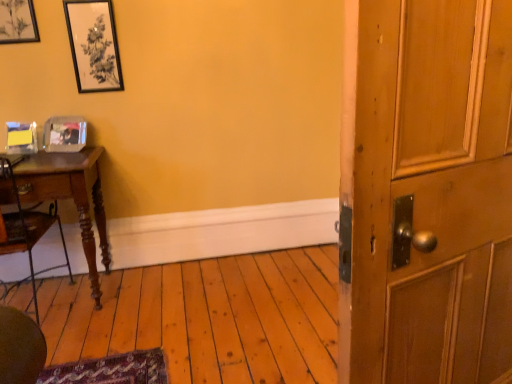
Question: Is matte black picture frame at upper left, the 3th picture frame ordered from the bottom, in contact with clear plastic picture frame at left, the 1th picture frame from the bottom?

Choices:
 (A) no
 (B) yes

Answer: (A)

Question: Does matte black picture frame at upper left, the 3th picture frame ordered from the bottom, have a smaller size compared to clear plastic picture frame at left, the 1th picture frame from the bottom?

Choices:
 (A) no
 (B) yes

Answer: (B)

Question: Is matte black picture frame at upper left, the 3th picture frame ordered from the bottom, at the left side of clear plastic picture frame at left, which is the third picture frame in top-to-bottom order?

Choices:
 (A) no
 (B) yes

Answer: (B)

Question: Is matte black picture frame at upper left, the 1th picture frame from the top, looking in the opposite direction of clear plastic picture frame at left, the 1th picture frame from the bottom?

Choices:
 (A) no
 (B) yes

Answer: (A)

Question: Is matte black picture frame at upper left, the 1th picture frame from the top, facing towards clear plastic picture frame at left, the 1th picture frame from the bottom?

Choices:
 (A) no
 (B) yes

Answer: (A)

Question: From a real-world perspective, does matte black picture frame at upper left, the 3th picture frame ordered from the bottom, stand above clear plastic picture frame at left, the 1th picture frame from the bottom?

Choices:
 (A) yes
 (B) no

Answer: (A)

Question: Is black matte picture frame at upper left, which ranks as the 2th picture frame in top-to-bottom order, not close to matte black picture frame at upper left, the 1th picture frame from the top?

Choices:
 (A) no
 (B) yes

Answer: (A)

Question: Is black matte picture frame at upper left, which ranks as the 2th picture frame in top-to-bottom order, directly adjacent to matte black picture frame at upper left, the 1th picture frame from the top?

Choices:
 (A) yes
 (B) no

Answer: (B)

Question: From a real-world perspective, is black matte picture frame at upper left, which ranks as the 2th picture frame in top-to-bottom order, on matte black picture frame at upper left, the 3th picture frame ordered from the bottom?

Choices:
 (A) no
 (B) yes

Answer: (A)

Question: Can you confirm if black matte picture frame at upper left, arranged as the second picture frame when ordered from the bottom, is positioned to the right of matte black picture frame at upper left, the 3th picture frame ordered from the bottom?

Choices:
 (A) no
 (B) yes

Answer: (B)

Question: Is black matte picture frame at upper left, which ranks as the 2th picture frame in top-to-bottom order, not within matte black picture frame at upper left, the 3th picture frame ordered from the bottom?

Choices:
 (A) yes
 (B) no

Answer: (A)

Question: Is black matte picture frame at upper left, arranged as the second picture frame when ordered from the bottom, thinner than matte black picture frame at upper left, the 3th picture frame ordered from the bottom?

Choices:
 (A) yes
 (B) no

Answer: (A)

Question: Does matte black picture frame at upper left, the 3th picture frame ordered from the bottom, lie behind black matte picture frame at upper left, arranged as the second picture frame when ordered from the bottom?

Choices:
 (A) yes
 (B) no

Answer: (B)